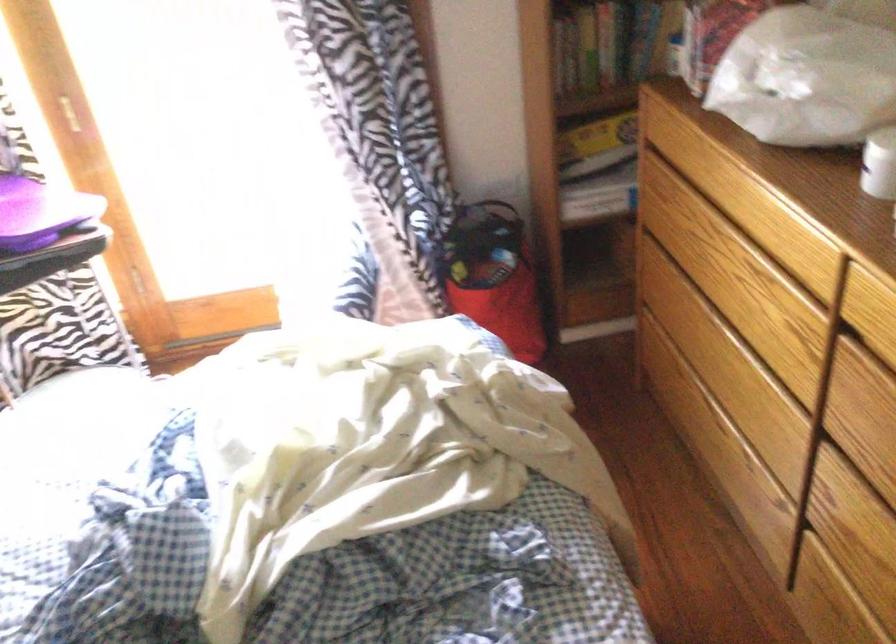
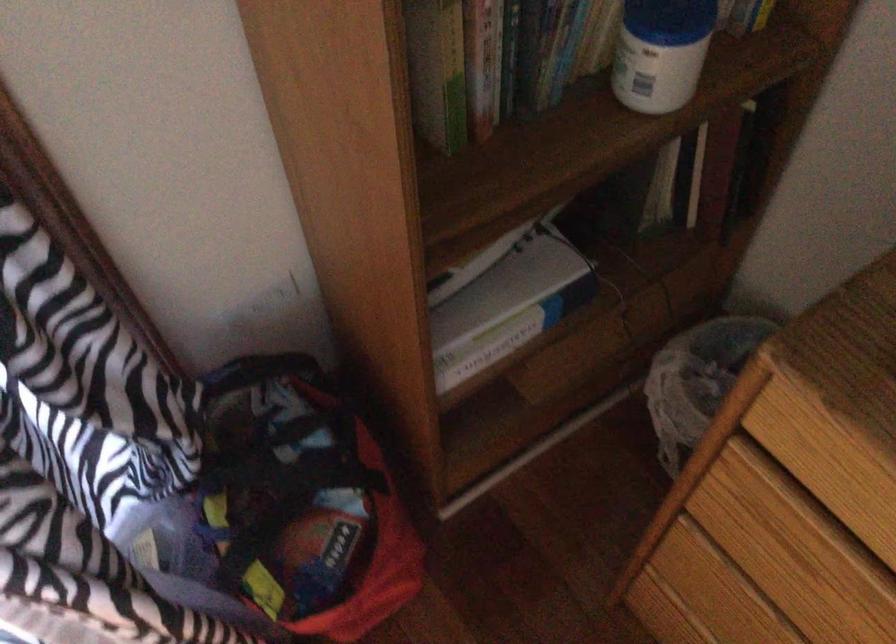
The point at (x=659, y=178) is marked in the first image. Where is the corresponding point in the second image?

(780, 526)